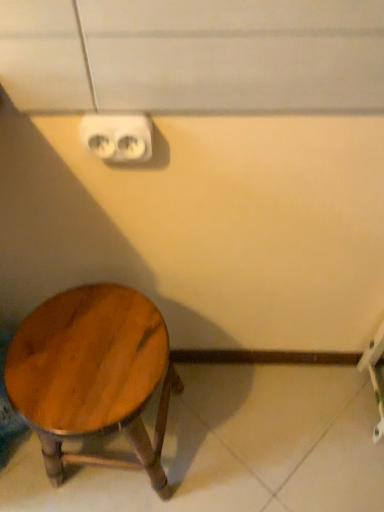
Question: From a real-world perspective, is white plastic outlet at upper center below shiny brown wood stool at lower left?

Choices:
 (A) yes
 (B) no

Answer: (B)

Question: Does white plastic outlet at upper center have a lesser height compared to shiny brown wood stool at lower left?

Choices:
 (A) no
 (B) yes

Answer: (B)

Question: From the image's perspective, is white plastic outlet at upper center located beneath shiny brown wood stool at lower left?

Choices:
 (A) no
 (B) yes

Answer: (A)

Question: Is shiny brown wood stool at lower left located within white plastic outlet at upper center?

Choices:
 (A) no
 (B) yes

Answer: (A)

Question: From a real-world perspective, is white plastic outlet at upper center on top of shiny brown wood stool at lower left?

Choices:
 (A) yes
 (B) no

Answer: (A)

Question: Can you confirm if white plastic outlet at upper center is wider than shiny brown wood stool at lower left?

Choices:
 (A) yes
 (B) no

Answer: (B)

Question: Does shiny brown wood stool at lower left have a lesser height compared to white plastic outlet at upper center?

Choices:
 (A) yes
 (B) no

Answer: (B)

Question: Is white plastic outlet at upper center at the back of shiny brown wood stool at lower left?

Choices:
 (A) no
 (B) yes

Answer: (A)

Question: From the image's perspective, is shiny brown wood stool at lower left under white plastic outlet at upper center?

Choices:
 (A) no
 (B) yes

Answer: (B)

Question: Does shiny brown wood stool at lower left appear on the right side of white plastic outlet at upper center?

Choices:
 (A) yes
 (B) no

Answer: (B)

Question: Is there a large distance between shiny brown wood stool at lower left and white plastic outlet at upper center?

Choices:
 (A) yes
 (B) no

Answer: (B)

Question: Is white plastic outlet at upper center surrounded by shiny brown wood stool at lower left?

Choices:
 (A) no
 (B) yes

Answer: (A)

Question: From a real-world perspective, is white plastic outlet at upper center physically located above or below shiny brown wood stool at lower left?

Choices:
 (A) above
 (B) below

Answer: (A)